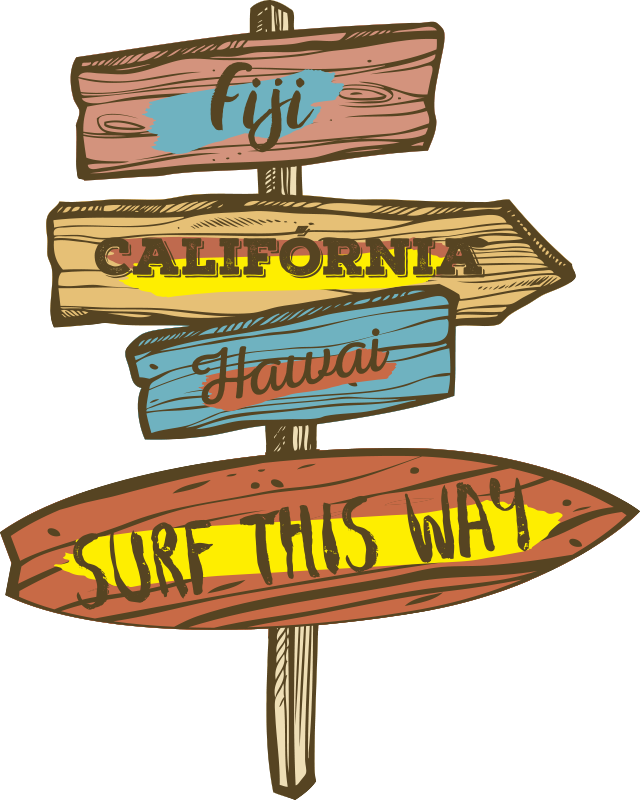
Where is `wood signs`? wood signs is located at coordinates (189, 497), (82, 285), (179, 382), (113, 144).